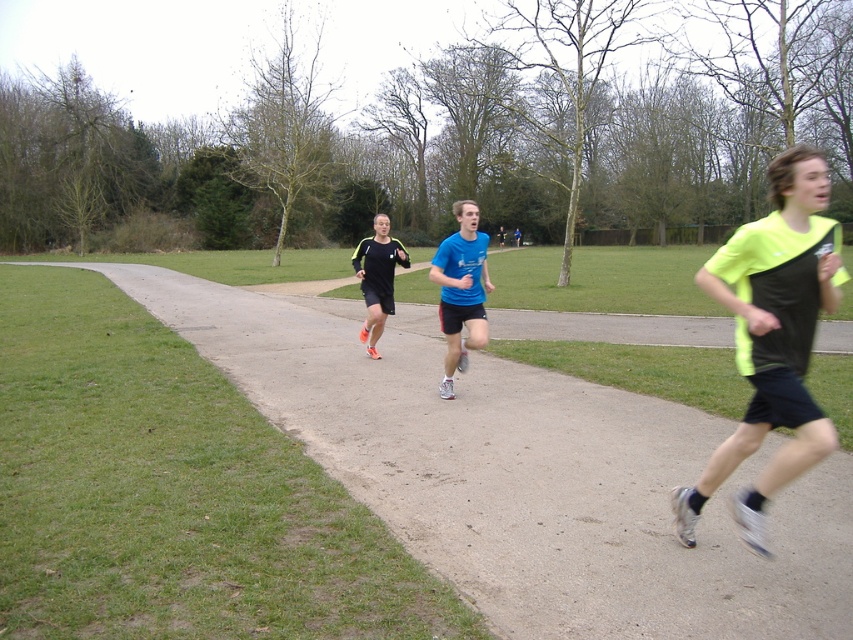
Question: Which object is closer to the camera taking this photo?

Choices:
 (A) neon yellow fabric at center
 (B) smooth asphalt path at center

Answer: (A)

Question: Can you confirm if neon yellow fabric at center is positioned to the right of blue matte shirt at center?

Choices:
 (A) yes
 (B) no

Answer: (A)

Question: Does smooth asphalt path at center appear over blue matte shirt at center?

Choices:
 (A) no
 (B) yes

Answer: (A)

Question: Which object is the closest to the blue matte shirt at center?

Choices:
 (A) smooth asphalt path at center
 (B) neon yellow fabric at center

Answer: (A)

Question: Does smooth asphalt path at center have a smaller size compared to neon yellow fabric at center?

Choices:
 (A) no
 (B) yes

Answer: (B)

Question: Considering the real-world distances, which object is farthest from the neon yellow fabric at center?

Choices:
 (A) blue matte shirt at center
 (B) smooth asphalt path at center

Answer: (A)